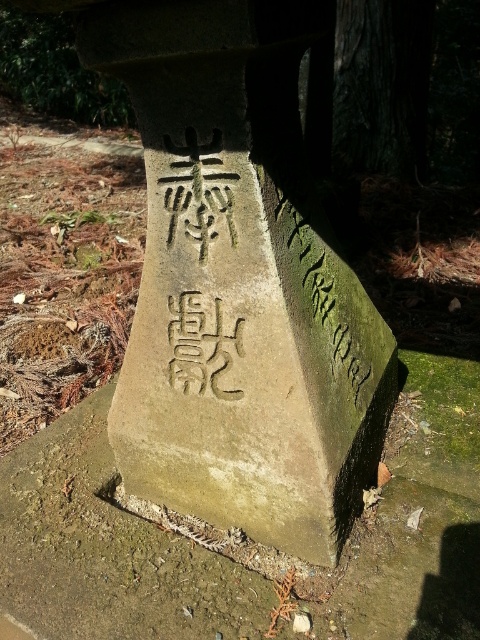
You are an archaeologist examining the stone monument. You notice two objects labeled as the green stone marker at center and the green mossy stone at center. Based on their positions, which one is positioned lower on the monument?

The green stone marker at center is located below the green mossy stone at center, so the green stone marker at center is positioned lower on the monument.

You are a park maintenance worker who needs to place a new bench in the park. The bench is 20 inches wide. There are two stones in the area, the green stone marker at center and the green mossy stone at center. Can you fit the bench between them without moving either stone?

The green stone marker at center is 19.19 inches from green mossy stone at center. Since the bench is 20 inches wide, it cannot fit between them as the distance is less than the bench width.

You are standing in front of the stone monument and want to touch the two points mentioned. Which point, point (129,602) or point (324,273), will you reach first?

Point (129,602) is closer to the viewer than point (324,273), so you will reach it first.